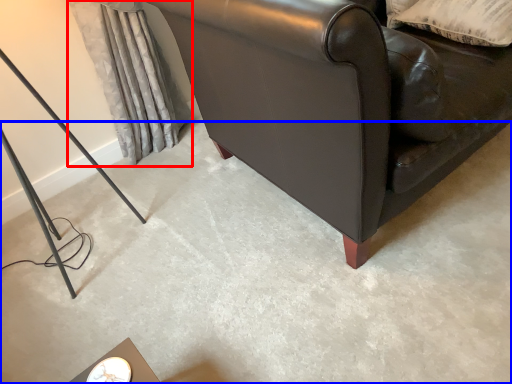
Question: Which object appears farthest to the camera in this image, curtain (highlighted by a red box) or concrete (highlighted by a blue box)?

Choices:
 (A) curtain
 (B) concrete

Answer: (A)